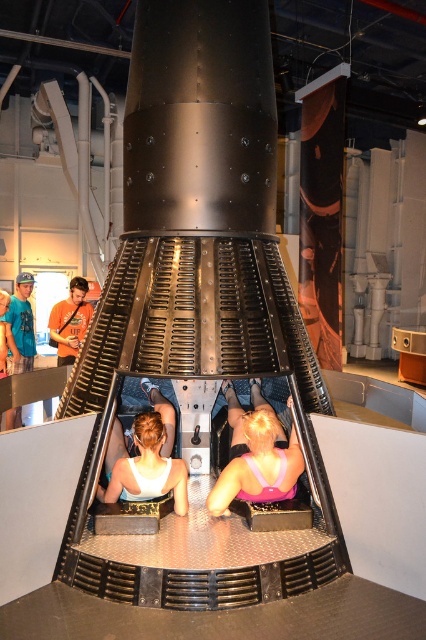
Can you confirm if pink fabric at center is positioned to the right of orange t-shirt at center?

Correct, you'll find pink fabric at center to the right of orange t-shirt at center.

This screenshot has height=640, width=426. Describe the element at coordinates (256, 454) in the screenshot. I see `pink fabric at center` at that location.

Which is behind, point (276, 451) or point (58, 339)?

Positioned behind is point (58, 339).

I want to click on pink fabric at center, so click(x=256, y=454).

Is white matte tank top at center positioned in front of orange t-shirt at center?

That is True.

Can you confirm if white matte tank top at center is positioned below orange t-shirt at center?

Indeed, white matte tank top at center is positioned under orange t-shirt at center.

The height and width of the screenshot is (640, 426). What do you see at coordinates (146, 458) in the screenshot? I see `white matte tank top at center` at bounding box center [146, 458].

The width and height of the screenshot is (426, 640). Find the location of `white matte tank top at center`. white matte tank top at center is located at coordinates (146, 458).

Which is more to the left, pink fabric at center or white matte tank top at center?

white matte tank top at center is more to the left.

This screenshot has height=640, width=426. In order to click on pink fabric at center in this screenshot , I will do pyautogui.click(x=256, y=454).

This screenshot has width=426, height=640. I want to click on pink fabric at center, so click(256, 454).